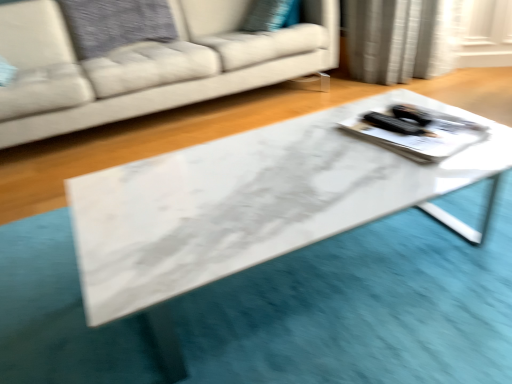
What do you see at coordinates (417, 132) in the screenshot?
I see `white glossy tray at center` at bounding box center [417, 132].

This screenshot has width=512, height=384. I want to click on white fabric couch at center, so click(148, 64).

The width and height of the screenshot is (512, 384). Describe the element at coordinates (252, 202) in the screenshot. I see `white marble table at center` at that location.

At what (x,y) coordinates should I click in order to perform the action: click on white glossy tray at center. Please return your answer as a coordinate pair (x, y). This screenshot has width=512, height=384. Looking at the image, I should click on (417, 132).

Is point (115, 250) positioned behind point (16, 85)?

No.

How many degrees apart are the facing directions of white marble table at center and white fabric couch at center?

white marble table at center and white fabric couch at center are facing 91.5 degrees away from each other.

Is white marble table at center outside of white fabric couch at center?

white marble table at center lies outside white fabric couch at center's area.

From the image's perspective, who appears lower, white marble table at center or white fabric couch at center?

white marble table at center appears lower in the image.

Are white fabric couch at center and white glossy tray at center making contact?

white fabric couch at center is not next to white glossy tray at center, and they're not touching.

How many degrees apart are the facing directions of white fabric couch at center and white glossy tray at center?

The angular difference between white fabric couch at center and white glossy tray at center is 82.2 degrees.

From a real-world perspective, who is located higher, white fabric couch at center or white glossy tray at center?

white fabric couch at center, from a real-world perspective.

Does white fabric couch at center come behind white glossy tray at center?

Yes, it is.

Where is `tray on the right of the white fabric couch at center`? tray on the right of the white fabric couch at center is located at coordinates (417, 132).

From a real-world perspective, is white glossy tray at center positioned above or below white fabric couch at center?

In terms of real-world spatial position, white glossy tray at center is below white fabric couch at center.

Is white glossy tray at center looking in the opposite direction of white fabric couch at center?

white glossy tray at center does not have its back to white fabric couch at center.

Does white glossy tray at center have a larger size compared to white fabric couch at center?

Actually, white glossy tray at center might be smaller than white fabric couch at center.

From the image's perspective, is white marble table at center located above or below white glossy tray at center?

Clearly, from the image's perspective, white marble table at center is below white glossy tray at center.

Is white glossy tray at center at the back of white marble table at center?

That's not correct — white marble table at center is not looking away from white glossy tray at center.

Can you confirm if white marble table at center is taller than white glossy tray at center?

Yes.

How distant is white marble table at center from white glossy tray at center?

white marble table at center is 27.55 centimeters away from white glossy tray at center.

Considering the relative sizes of white fabric couch at center and white marble table at center in the image provided, is white fabric couch at center taller than white marble table at center?

Correct, white fabric couch at center is much taller as white marble table at center.

Is white fabric couch at center oriented away from white marble table at center?

No, white marble table at center is not at the back of white fabric couch at center.

From a real-world perspective, between white fabric couch at center and white marble table at center, who is vertically higher?

white fabric couch at center.

Is white glossy tray at center facing away from white marble table at center?

white glossy tray at center is not turned away from white marble table at center.

Is point (394, 133) positioned before point (236, 185)?

No, (394, 133) is further to viewer.

From a real-world perspective, is white glossy tray at center on top of white marble table at center?

Correct, in the physical world, white glossy tray at center is higher than white marble table at center.

In the scene shown: Considering the sizes of objects white glossy tray at center and white marble table at center in the image provided, who is thinner, white glossy tray at center or white marble table at center?

white glossy tray at center.

The image size is (512, 384). I want to click on studio couch positioned vertically above the white marble table at center (from a real-world perspective), so click(x=148, y=64).

This screenshot has height=384, width=512. Identify the location of studio couch above the white glossy tray at center (from the image's perspective). (148, 64).

Based on their spatial positions, is white glossy tray at center or white fabric couch at center further from white marble table at center?

The object further to white marble table at center is white fabric couch at center.

From the image, which object appears to be farther from white glossy tray at center, white marble table at center or white fabric couch at center?

The object further to white glossy tray at center is white fabric couch at center.

Estimate the real-world distances between objects in this image. Which object is closer to white glossy tray at center, white fabric couch at center or white marble table at center?

white marble table at center lies closer to white glossy tray at center than the other object.

Based on their spatial positions, is white fabric couch at center or white glossy tray at center further from white marble table at center?

white fabric couch at center is further to white marble table at center.

From the image, which object appears to be farther from white fabric couch at center, white marble table at center or white glossy tray at center?

The object further to white fabric couch at center is white glossy tray at center.

From the image, which object appears to be nearer to white fabric couch at center, white glossy tray at center or white marble table at center?

The object closer to white fabric couch at center is white marble table at center.

Image resolution: width=512 pixels, height=384 pixels. Find the location of `table situated between white fabric couch at center and white glossy tray at center from left to right`. table situated between white fabric couch at center and white glossy tray at center from left to right is located at coordinates (252, 202).